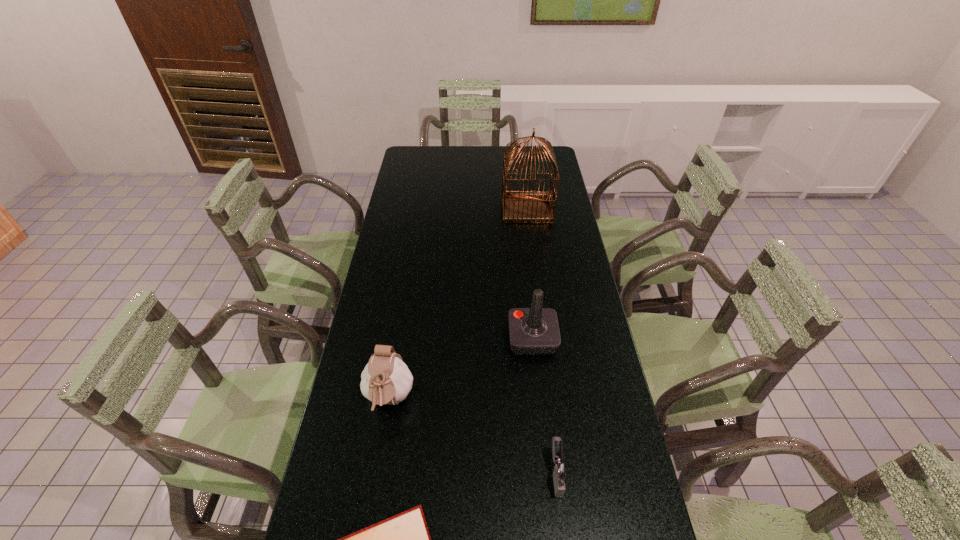
Find the location of a particular element. This screenshot has width=960, height=540. birdcage is located at coordinates (519, 206).

At what (x,y) coordinates should I click in order to perform the action: click on the tallest object. Please return your answer as a coordinate pair (x, y). Looking at the image, I should click on (519, 206).

The image size is (960, 540). I want to click on the fourth nearest object, so click(532, 331).

Identify the location of pouch. (386, 379).

Locate an element on the screen. The width and height of the screenshot is (960, 540). the fourth farthest object is located at coordinates (559, 469).

At what (x,y) coordinates should I click in order to perform the action: click on igniter. Please return your answer as a coordinate pair (x, y). Image resolution: width=960 pixels, height=540 pixels. Looking at the image, I should click on (559, 469).

At what (x,y) coordinates should I click in order to perform the action: click on free space located 0.180m on the left of the birdcage. Please return your answer as a coordinate pair (x, y). Looking at the image, I should click on (459, 208).

What are the coordinates of `vacant space located 0.380m on the front of the joystick` in the screenshot? It's located at (x=549, y=495).

Identify the location of free spot located 0.100m on the front-facing side of the third nearest object. (378, 467).

I want to click on vacant space situated on the right of the fourth tallest object, so click(612, 473).